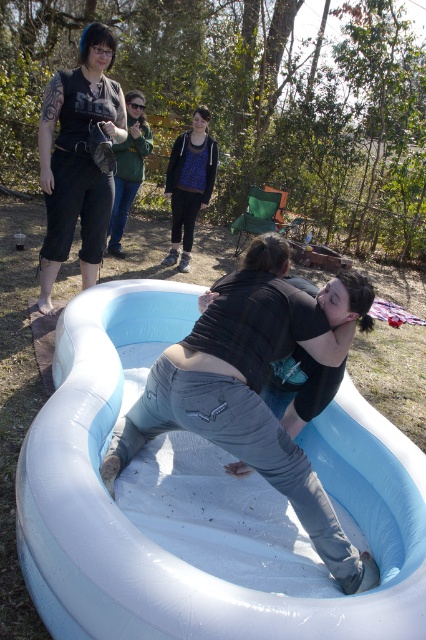
Who is lower down, white rubber pool at center or green fabric jacket at upper center?

white rubber pool at center is below.

Is the position of white rubber pool at center less distant than that of green fabric jacket at upper center?

Yes, it is in front of green fabric jacket at upper center.

Find the location of a particular element. white rubber pool at center is located at coordinates (160, 547).

Find the location of `white rubber pool at center`. white rubber pool at center is located at coordinates (160, 547).

Is blue printed hoodie at center to the right of green fabric jacket at upper center from the viewer's perspective?

Yes, blue printed hoodie at center is to the right of green fabric jacket at upper center.

Is blue printed hoodie at center closer to the viewer compared to green fabric jacket at upper center?

No, blue printed hoodie at center is further to the viewer.

At what (x,y) coordinates should I click in order to perform the action: click on blue printed hoodie at center. Please return your answer as a coordinate pair (x, y). The image size is (426, 640). Looking at the image, I should click on (189, 182).

What are the coordinates of `blue printed hoodie at center` in the screenshot? It's located at click(189, 182).

Can you confirm if white rubber pool at center is positioned to the left of blue printed hoodie at center?

In fact, white rubber pool at center is to the right of blue printed hoodie at center.

Is point (78, 634) positioned before point (189, 205)?

Yes, it is in front of point (189, 205).

The width and height of the screenshot is (426, 640). What are the coordinates of `white rubber pool at center` in the screenshot? It's located at (160, 547).

This screenshot has width=426, height=640. What are the coordinates of `white rubber pool at center` in the screenshot? It's located at (160, 547).